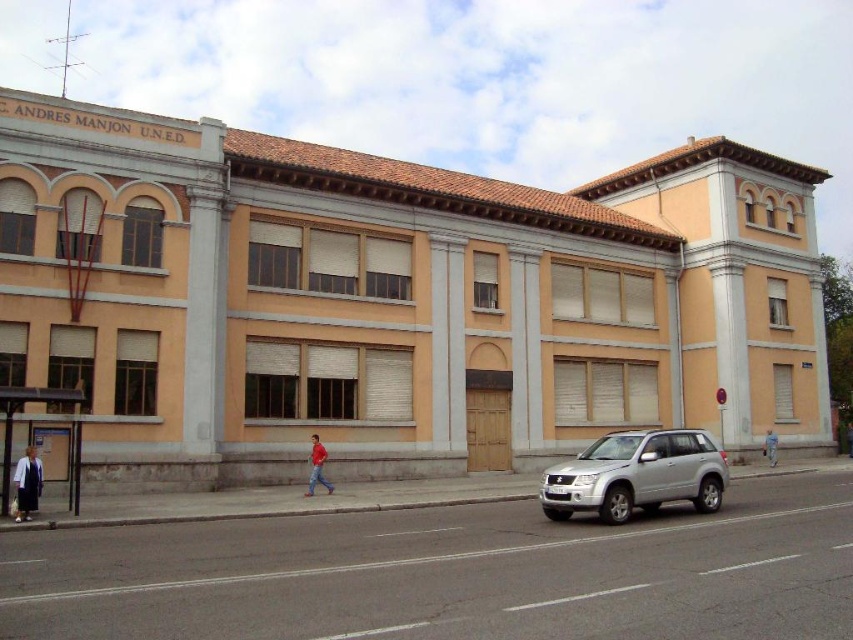
This screenshot has width=853, height=640. What do you see at coordinates (27, 483) in the screenshot?
I see `white fabric coat at lower left` at bounding box center [27, 483].

Can you confirm if white fabric coat at lower left is bigger than light blue denim jacket at center?

Correct, white fabric coat at lower left is larger in size than light blue denim jacket at center.

Locate an element on the screen. The width and height of the screenshot is (853, 640). white fabric coat at lower left is located at coordinates (27, 483).

Is point (635, 477) positioned before point (766, 454)?

Yes, it is.

Does silver metallic suv at lower right have a lesser height compared to light blue denim jacket at center?

No.

This screenshot has width=853, height=640. Describe the element at coordinates (636, 474) in the screenshot. I see `silver metallic suv at lower right` at that location.

Find the location of a particular element. Image resolution: width=853 pixels, height=640 pixels. silver metallic suv at lower right is located at coordinates (636, 474).

Does silver metallic suv at lower right appear under red cotton shirt at center?

Correct, silver metallic suv at lower right is located below red cotton shirt at center.

Does silver metallic suv at lower right have a lesser height compared to red cotton shirt at center?

In fact, silver metallic suv at lower right may be taller than red cotton shirt at center.

Measure the distance between silver metallic suv at lower right and camera.

The distance of silver metallic suv at lower right from camera is 19.37 meters.

Find the location of a particular element. silver metallic suv at lower right is located at coordinates (636, 474).